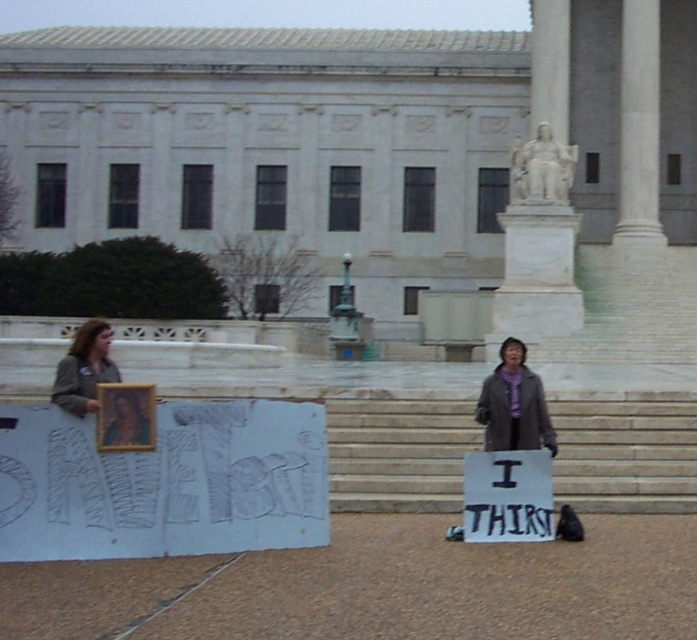
Question: Among these objects, which one is nearest to the camera?

Choices:
 (A) white stone stairs at center
 (B) white paper sign at center
 (C) white marble column at center
 (D) matte wooden frame at center

Answer: (D)

Question: Does gray wool coat at lower right come behind matte wooden frame at center?

Choices:
 (A) yes
 (B) no

Answer: (A)

Question: Does white paper sign at center come behind gray wool coat at lower right?

Choices:
 (A) no
 (B) yes

Answer: (A)

Question: Which object appears closest to the camera in this image?

Choices:
 (A) gray wool coat at lower right
 (B) white marble column at center
 (C) matte wooden frame at center
 (D) white stone stairs at center

Answer: (C)

Question: Among these points, which one is farthest from the camera?

Choices:
 (A) (98, 317)
 (B) (583, 499)
 (C) (528, 432)

Answer: (A)

Question: Can you confirm if white marble column at center is smaller than white paper sign at center?

Choices:
 (A) yes
 (B) no

Answer: (B)